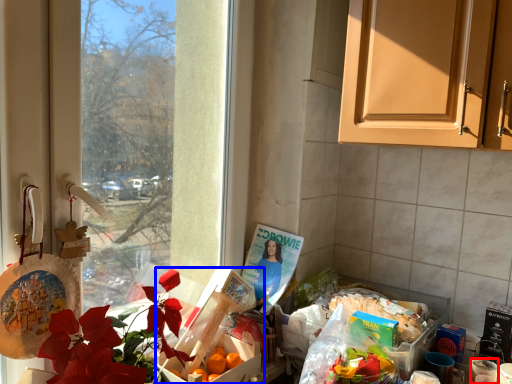
Question: Which object appears closest to the camera in this image, coffee cup (highlighted by a red box) or box (highlighted by a blue box)?

Choices:
 (A) coffee cup
 (B) box

Answer: (A)